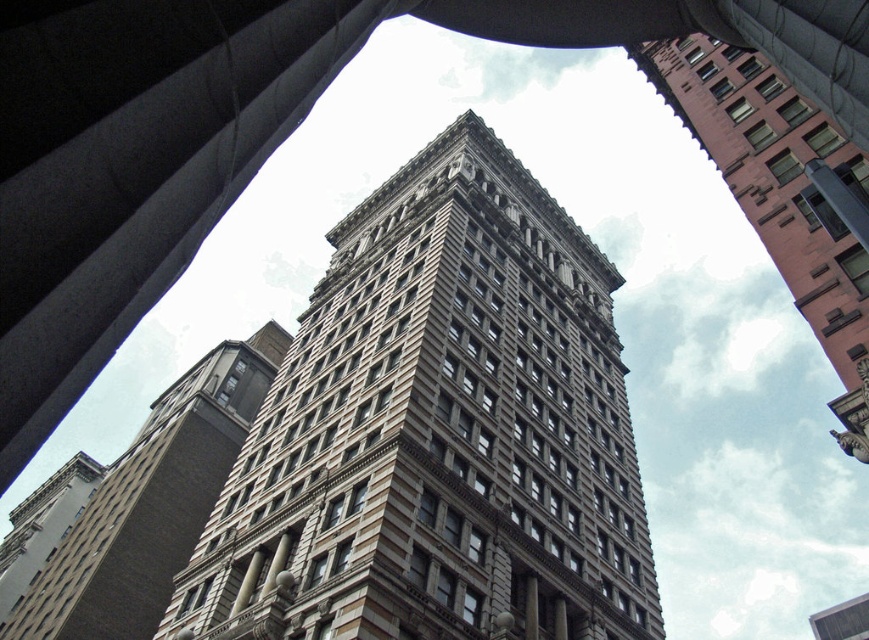
Question: Does brown stone tower at center appear on the left side of brown stone building at center?

Choices:
 (A) no
 (B) yes

Answer: (A)

Question: Which of the following is the closest to the observer?

Choices:
 (A) (85, 627)
 (B) (306, 556)

Answer: (B)

Question: Does brown stone tower at center appear under brown stone building at center?

Choices:
 (A) no
 (B) yes

Answer: (A)

Question: Which point is closer to the camera taking this photo?

Choices:
 (A) (837, 144)
 (B) (313, 358)

Answer: (A)

Question: Which point appears closest to the camera in this image?

Choices:
 (A) [600, 576]
 (B) [161, 497]

Answer: (A)

Question: Does brown stone tower at center appear under pink brick building at upper right?

Choices:
 (A) yes
 (B) no

Answer: (A)